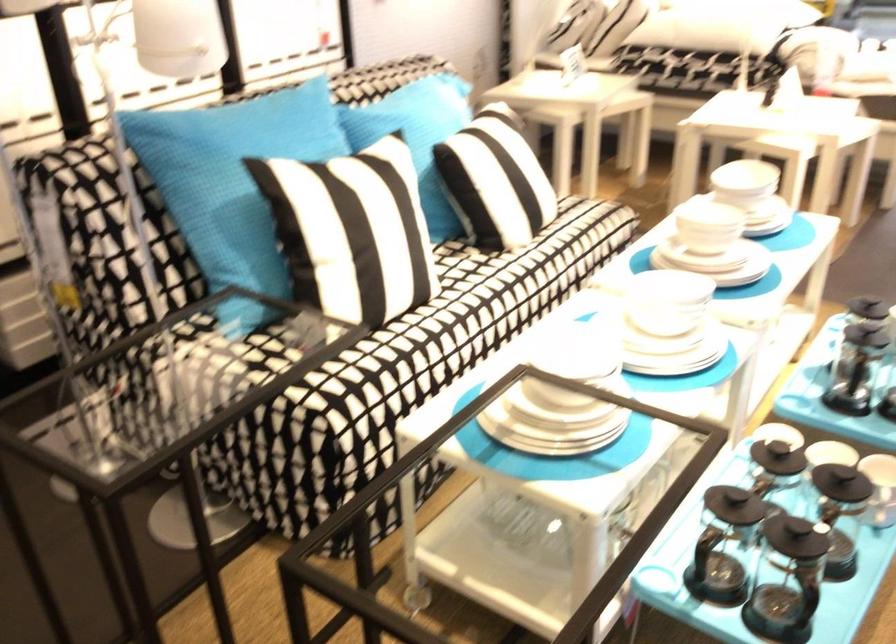
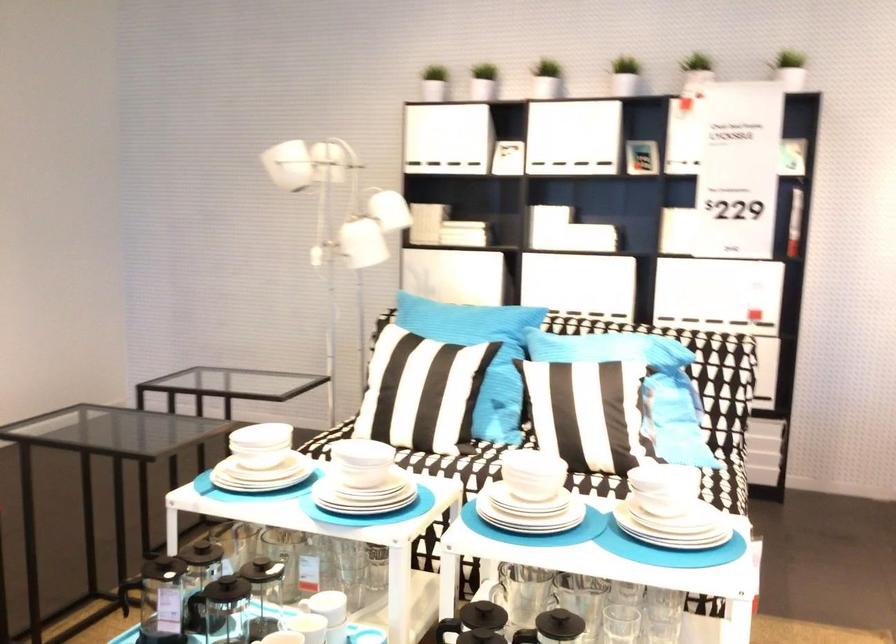
Where in the second image is the point corresponding to (x=728, y=223) from the first image?

(531, 474)